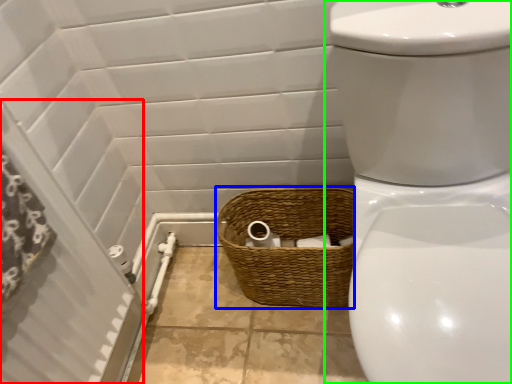
Question: Which object is the closest to the screen door (highlighted by a red box)? Choose among these: basket (highlighted by a blue box) or toilet (highlighted by a green box).

Choices:
 (A) basket
 (B) toilet

Answer: (A)